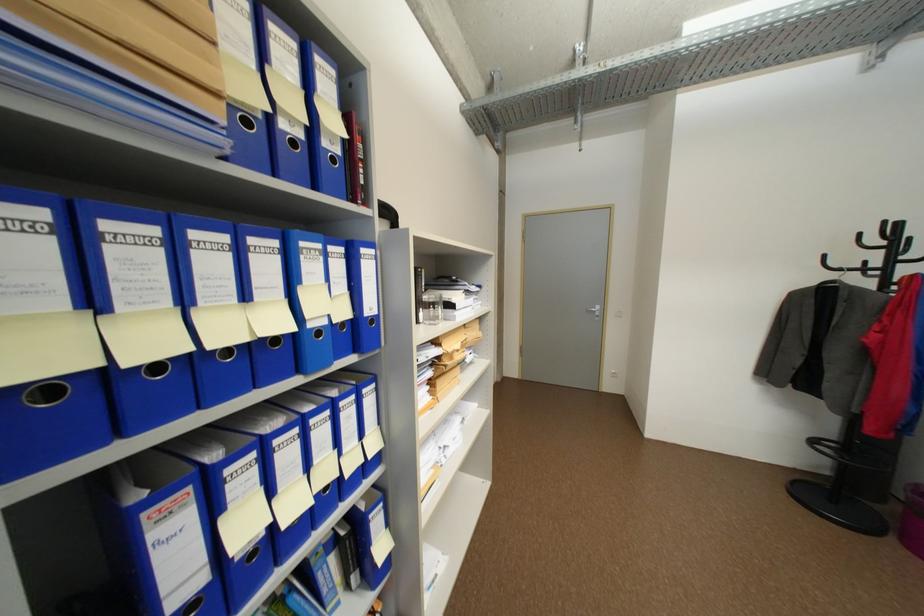
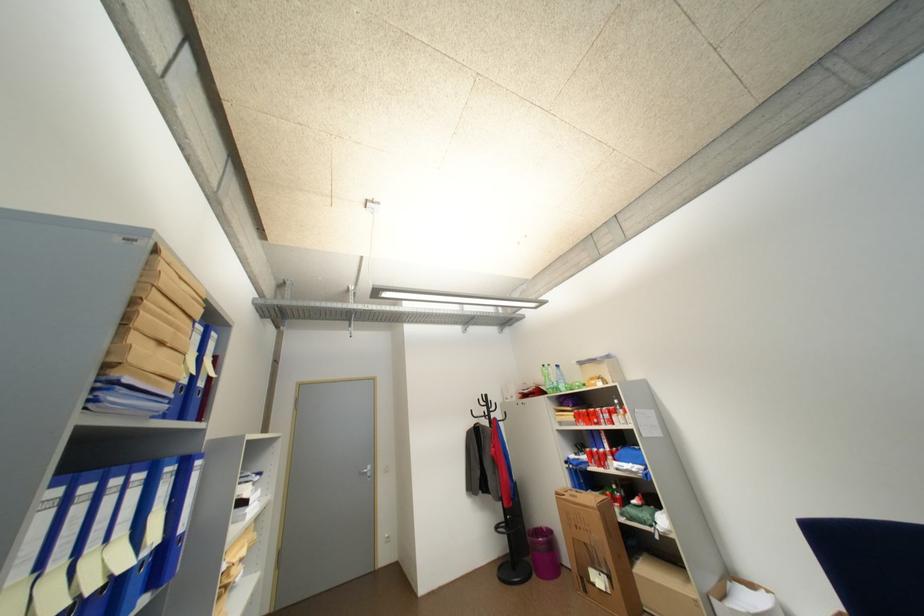
First-person continuous shooting, in which direction is the camera rotating?

The rotation direction of the camera is right-up.